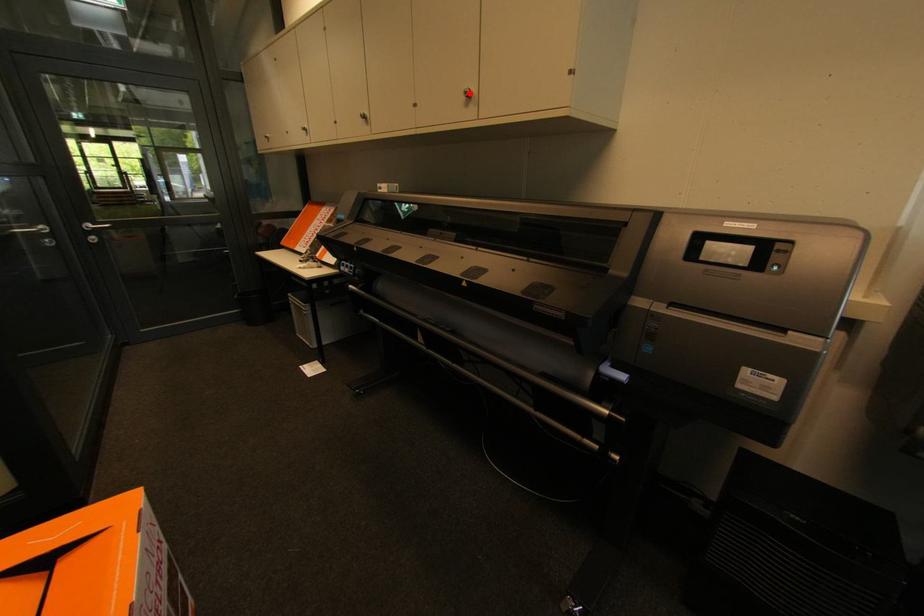
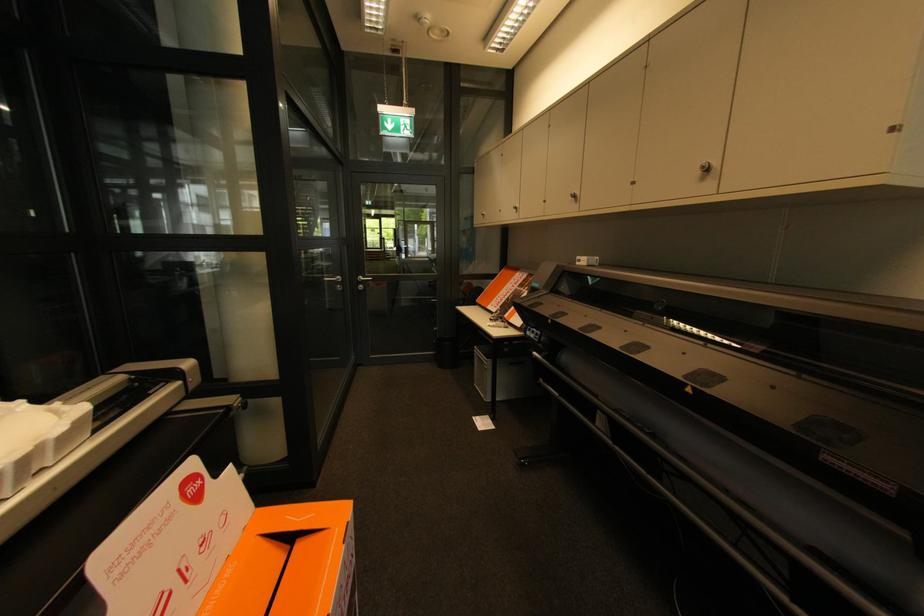
Where in the second image is the point corresponding to the highlighted location from the first image?

(707, 168)